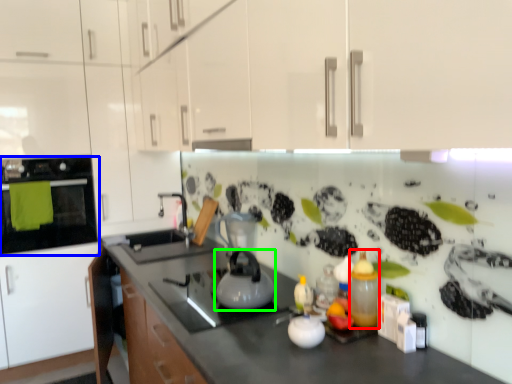
Question: Which object is positioned closest to bottle (highlighted by a red box)? Select from home appliance (highlighted by a blue box) and kitchen appliance (highlighted by a green box).

Choices:
 (A) home appliance
 (B) kitchen appliance

Answer: (B)